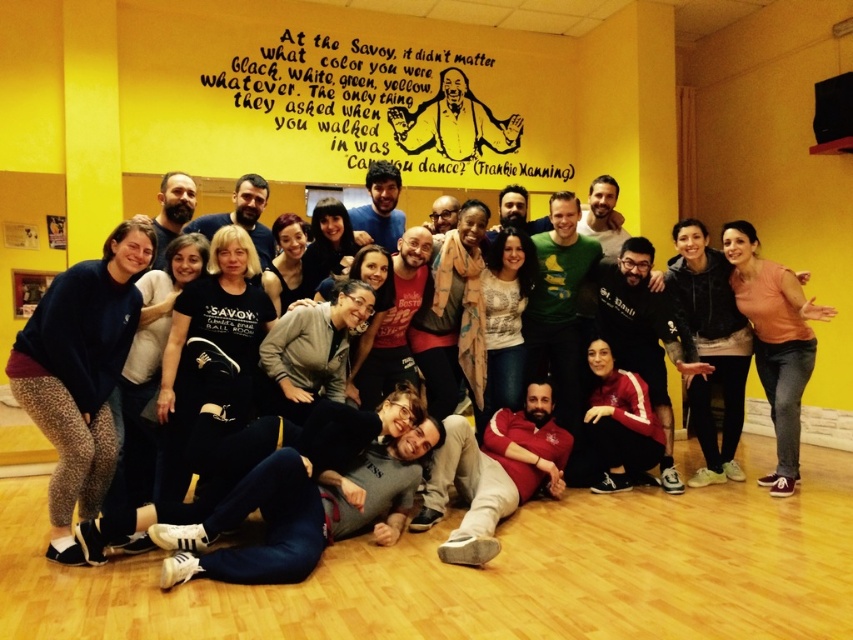
You are organizing a charity event and need to decide which of the two items, the dark blue fleece at lower left or the orange cotton shirt at right, would be better suited for a size chart display. Based on their sizes, which one should be placed in the section for larger items?

The orange cotton shirt at right should be placed in the section for larger items because it is bigger than the dark blue fleece at lower left.

You are a photographer standing at the center of the room. You want to take a photo that includes both the dark blue fleece at lower left and the orange cotton shirt at right. Can you position yourself so that both are in the frame without moving any subjects? Explain your reasoning.

The distance between the dark blue fleece at lower left and the orange cotton shirt at right is 3.76 meters. Since the photographer is at the center, they can adjust their angle or zoom to capture both items within the frame as they are positioned apart but within a typical camera lens range.